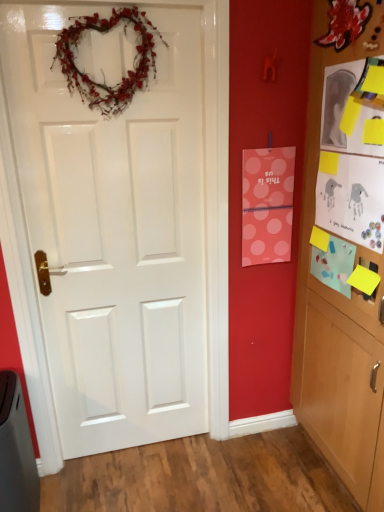
Question: Is matte blue paper at right, which is counted as the second postcard, starting from the right, spatially inside white paper postcard at upper right, the third postcard when ordered from left to right, or outside of it?

Choices:
 (A) inside
 (B) outside

Answer: (B)

Question: Is point click(x=342, y=272) positioned closer to the camera than point click(x=375, y=250)?

Choices:
 (A) farther
 (B) closer

Answer: (A)

Question: Which of these objects is positioned farthest from the white glossy door at center?

Choices:
 (A) white paper postcard at upper right, which is the 1th postcard from right to left
 (B) wooden cabinet at right
 (C) pink polka dot paper at upper right, placed as the 3th postcard when sorted from right to left
 (D) natural twig heart wreath at upper center
 (E) matte blue paper at right, which ranks as the second postcard in left-to-right order

Answer: (E)

Question: Which of these objects is positioned farthest from the wooden cabinet at right?

Choices:
 (A) matte blue paper at right, which ranks as the second postcard in left-to-right order
 (B) natural twig heart wreath at upper center
 (C) white glossy door at center
 (D) pink polka dot paper at upper right, placed as the 3th postcard when sorted from right to left
 (E) white paper postcard at upper right, the third postcard when ordered from left to right

Answer: (B)